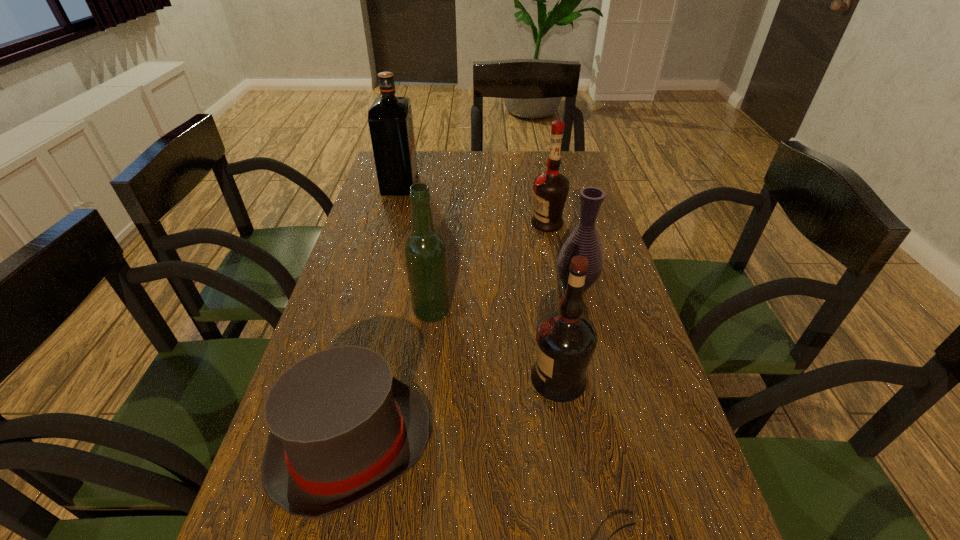
The height and width of the screenshot is (540, 960). In order to click on object that is the sixth nearest to the second liquor from left to right in this screenshot , I will do `click(390, 120)`.

The width and height of the screenshot is (960, 540). I want to click on the closest object to the dress hat, so click(425, 249).

Locate which liquor ranks third in proximity to the second farthest object. Please provide its 2D coordinates. Your answer should be formatted as a tuple, i.e. [(x, y)], where the tuple contains the x and y coordinates of a point satisfying the conditions above.

[(566, 339)]

Where is `liquor that stands as the third closest to the nearest liquor`? This screenshot has height=540, width=960. liquor that stands as the third closest to the nearest liquor is located at coordinates (390, 120).

Where is `vacant space that satisfies the following two spatial constraints: 1. on the front label of the farthest object; 2. on the left side of the second liquor from left to right`? The width and height of the screenshot is (960, 540). vacant space that satisfies the following two spatial constraints: 1. on the front label of the farthest object; 2. on the left side of the second liquor from left to right is located at coordinates (366, 311).

At what (x,y) coordinates should I click in order to perform the action: click on vacant space that satisfies the following two spatial constraints: 1. on the back side of the third farthest liquor; 2. on the right side of the third shortest object. Please return your answer as a coordinate pair (x, y). This screenshot has height=540, width=960. Looking at the image, I should click on (435, 286).

Identify the location of vacant space that satisfies the following two spatial constraints: 1. on the front side of the third shortest object; 2. on the surface of the nearest liquor. (598, 379).

At what (x,y) coordinates should I click in order to perform the action: click on vacant region that satisfies the following two spatial constraints: 1. on the front and back of the sixth nearest object; 2. on the left side of the fifth tallest object. Please return your answer as a coordinate pair (x, y). The image size is (960, 540). Looking at the image, I should click on (560, 286).

Where is `free space that satisfies the following two spatial constraints: 1. on the front label of the sixth tallest object; 2. on the left side of the leftmost liquor`? The width and height of the screenshot is (960, 540). free space that satisfies the following two spatial constraints: 1. on the front label of the sixth tallest object; 2. on the left side of the leftmost liquor is located at coordinates (329, 445).

You are a GUI agent. You are given a task and a screenshot of the screen. Output one action in this format:
    pyautogui.click(x=<x>, y=<y>)
    Task: Click on the vacant area that satisfies the following two spatial constraints: 1. on the front label of the farthest liquor; 2. on the back side of the second nearest liquor
    This screenshot has height=540, width=960.
    Given the screenshot: What is the action you would take?
    pyautogui.click(x=366, y=311)